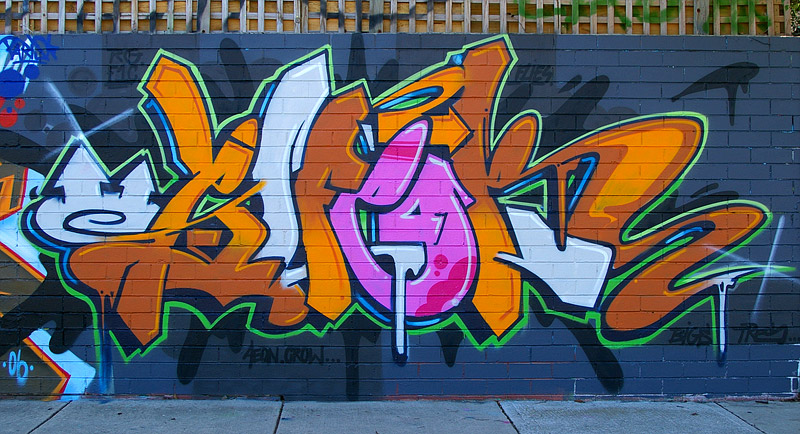
This screenshot has width=800, height=434. I want to click on light pink in wall tag, so click(432, 226), click(430, 192), click(392, 181).